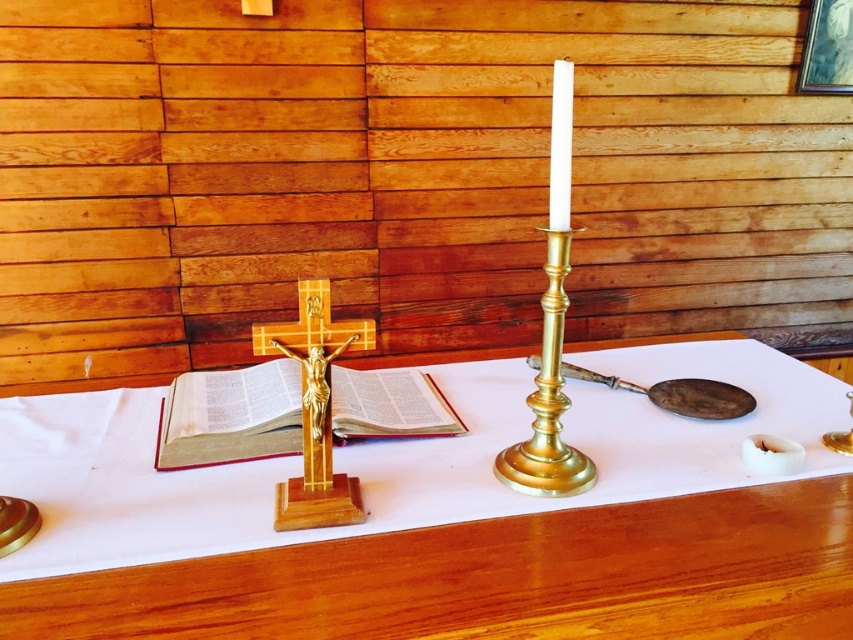
Does point (296, 346) come behind point (563, 154)?

That is True.

Where is `gold polished wood crucifix at center`? gold polished wood crucifix at center is located at coordinates (315, 410).

This screenshot has height=640, width=853. Describe the element at coordinates (315, 410) in the screenshot. I see `gold polished wood crucifix at center` at that location.

At what (x,y) coordinates should I click in order to perform the action: click on gold polished wood crucifix at center. Please return your answer as a coordinate pair (x, y). Looking at the image, I should click on (315, 410).

Is gold polished brass candle holder at center further to the viewer compared to white polished wood candle at center?

Yes.

Between gold polished brass candle holder at center and white polished wood candle at center, which one has more height?

gold polished brass candle holder at center

Is point (543, 333) in front of point (560, 221)?

No, (543, 333) is further to viewer.

At what (x,y) coordinates should I click in order to perform the action: click on gold polished brass candle holder at center. Please return your answer as a coordinate pair (x, y). Looking at the image, I should click on (548, 401).

Does matte gold book at center have a smaller size compared to gold polished brass candle holder at center?

Actually, matte gold book at center might be larger than gold polished brass candle holder at center.

Can you confirm if matte gold book at center is bigger than gold polished brass candle holder at center?

Indeed, matte gold book at center has a larger size compared to gold polished brass candle holder at center.

From the picture: Who is more distant from viewer, (187, 381) or (558, 266)?

Point (187, 381)

In order to click on matte gold book at center in this screenshot , I will do `click(230, 416)`.